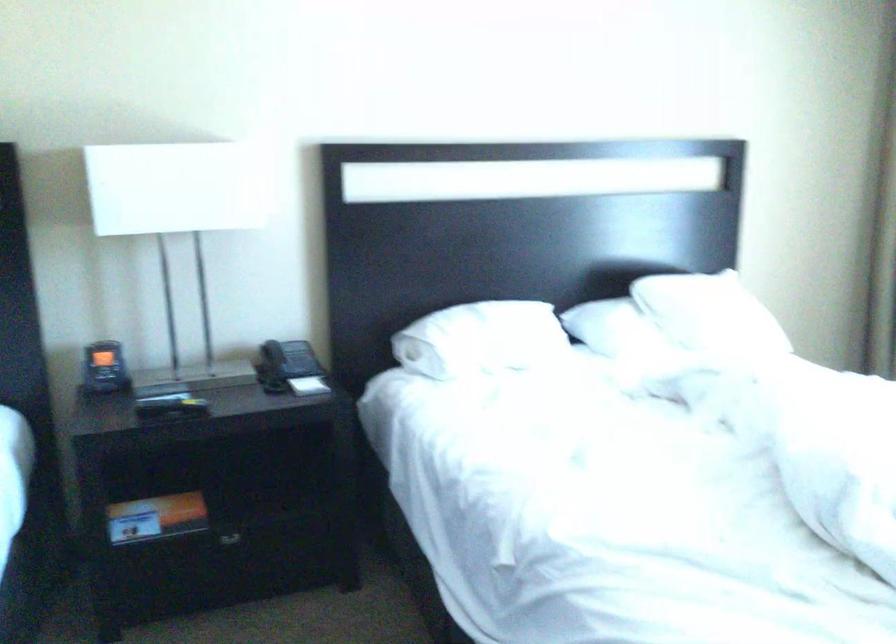
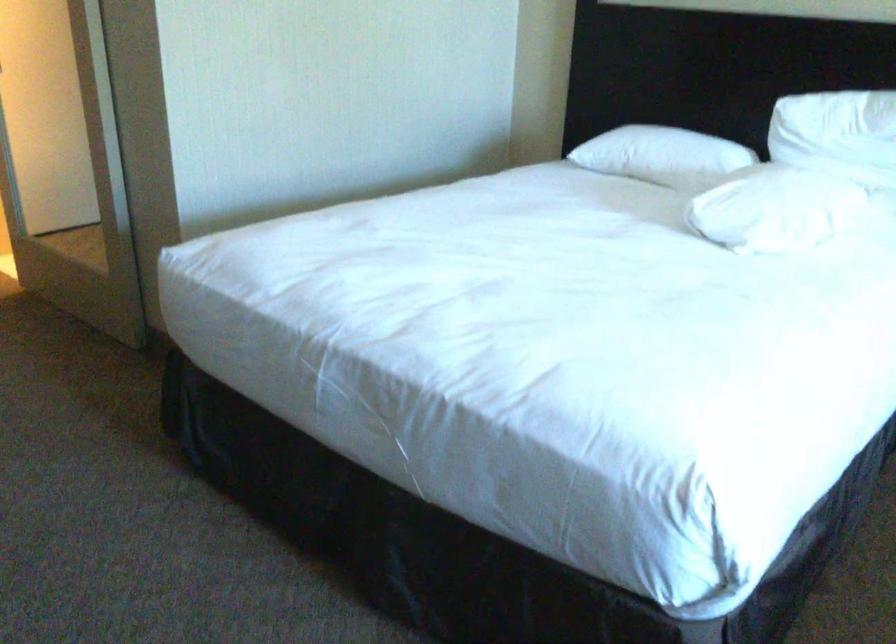
The images are taken continuously from a first-person perspective. In which direction is your viewpoint rotating?

The camera's rotation is toward left-down.